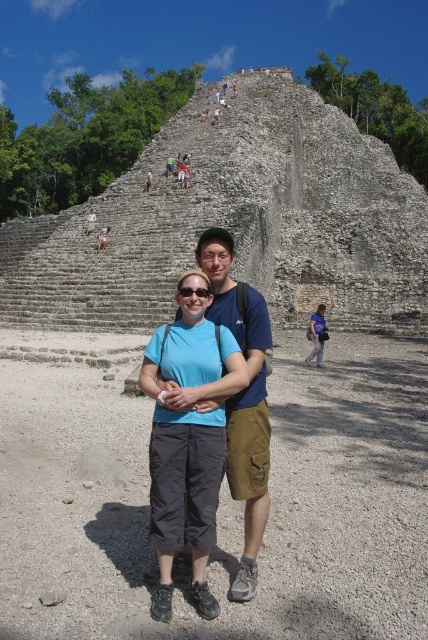
Question: Does matte blue shirt at center appear on the left side of blue fabric backpack at center?

Choices:
 (A) no
 (B) yes

Answer: (B)

Question: Can you confirm if matte blue shirt at center is bigger than blue cotton shirt at center?

Choices:
 (A) yes
 (B) no

Answer: (B)

Question: Among these objects, which one is farthest from the camera?

Choices:
 (A) blue cotton shirt at center
 (B) matte blue shirt at center
 (C) blue fabric backpack at center

Answer: (C)

Question: Does matte blue shirt at center come in front of blue cotton shirt at center?

Choices:
 (A) no
 (B) yes

Answer: (B)

Question: Which point appears farthest from the camera in this image?

Choices:
 (A) (321, 349)
 (B) (267, 476)

Answer: (A)

Question: Based on their relative distances, which object is nearer to the matte blue shirt at center?

Choices:
 (A) blue cotton shirt at center
 (B) blue fabric backpack at center

Answer: (A)